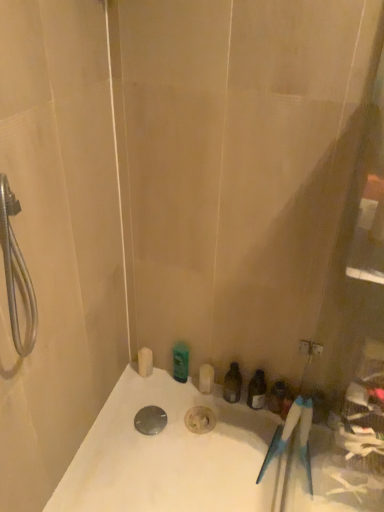
The width and height of the screenshot is (384, 512). I want to click on free space to the left of matte plastic toiletries at lower right, which appears as the first toiletry when viewed from the right, so click(220, 423).